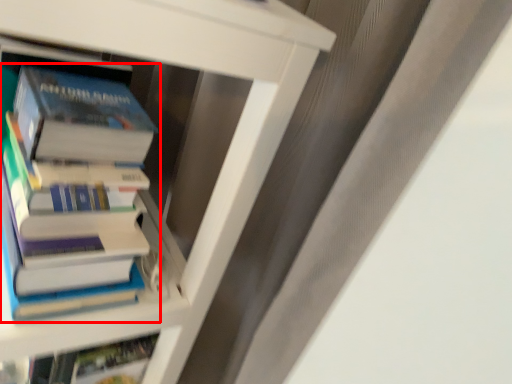
Question: In this image, where is book (annotated by the red box) located relative to book?

Choices:
 (A) left
 (B) right

Answer: (B)